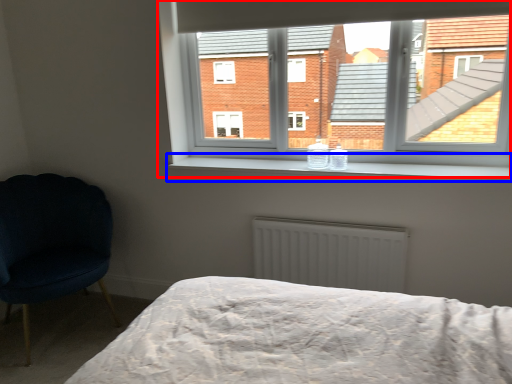
Question: Which object appears closest to the camera in this image, window (highlighted by a red box) or window sill (highlighted by a blue box)?

Choices:
 (A) window
 (B) window sill

Answer: (B)